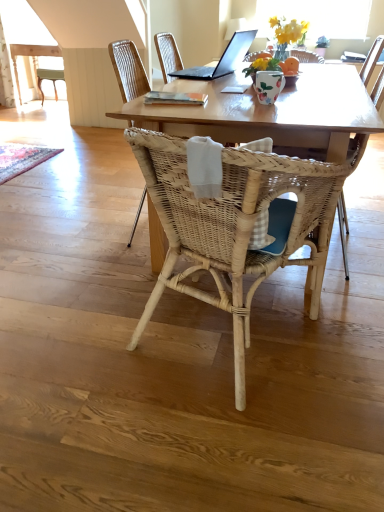
Where is `vacant space in front of woven wood chair at center, positioned as the first chair in front-to-back order`? The height and width of the screenshot is (512, 384). vacant space in front of woven wood chair at center, positioned as the first chair in front-to-back order is located at coordinates (225, 438).